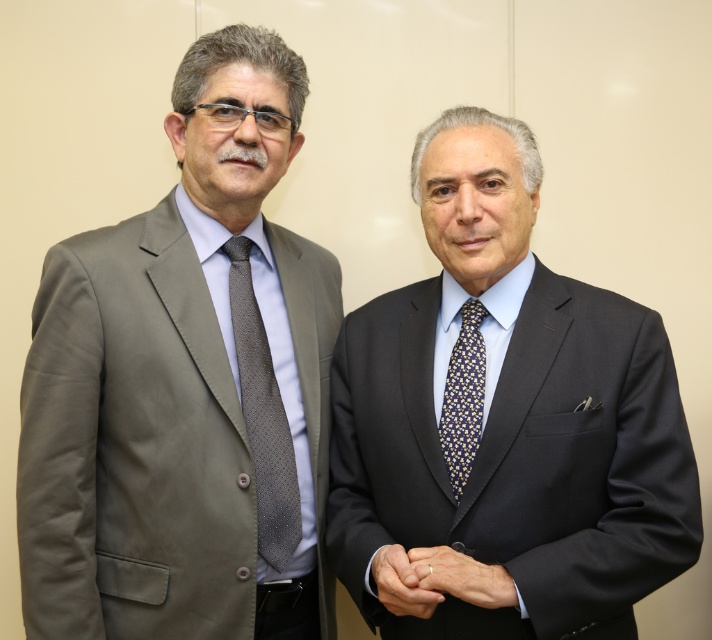
The image size is (712, 640). In order to click on gray dotted tie at left in this screenshot , I will do `click(261, 416)`.

Who is positioned more to the left, gray dotted tie at left or gold textured ring at center?

gray dotted tie at left

What do you see at coordinates (261, 416) in the screenshot?
I see `gray dotted tie at left` at bounding box center [261, 416].

Where is `gray dotted tie at left`? This screenshot has width=712, height=640. gray dotted tie at left is located at coordinates (261, 416).

Who is higher up, blue dotted silk tie at center or gold textured ring at center?

blue dotted silk tie at center is higher up.

Is point (478, 396) closer to viewer compared to point (422, 605)?

No, (478, 396) is behind (422, 605).

This screenshot has width=712, height=640. In order to click on blue dotted silk tie at center in this screenshot , I will do `click(464, 397)`.

Who is taller, gray dotted tie at left or blue dotted silk tie at center?

gray dotted tie at left

From the picture: Who is more forward, [246,278] or [481,342]?

Positioned in front is point [481,342].

Between point (268, 428) and point (476, 388), which one is positioned in front?

Positioned in front is point (476, 388).

You are a GUI agent. You are given a task and a screenshot of the screen. Output one action in this format:
    pyautogui.click(x=<x>, y=<y>)
    Task: Click on the gray dotted tie at left
    
    Given the screenshot: What is the action you would take?
    pyautogui.click(x=261, y=416)